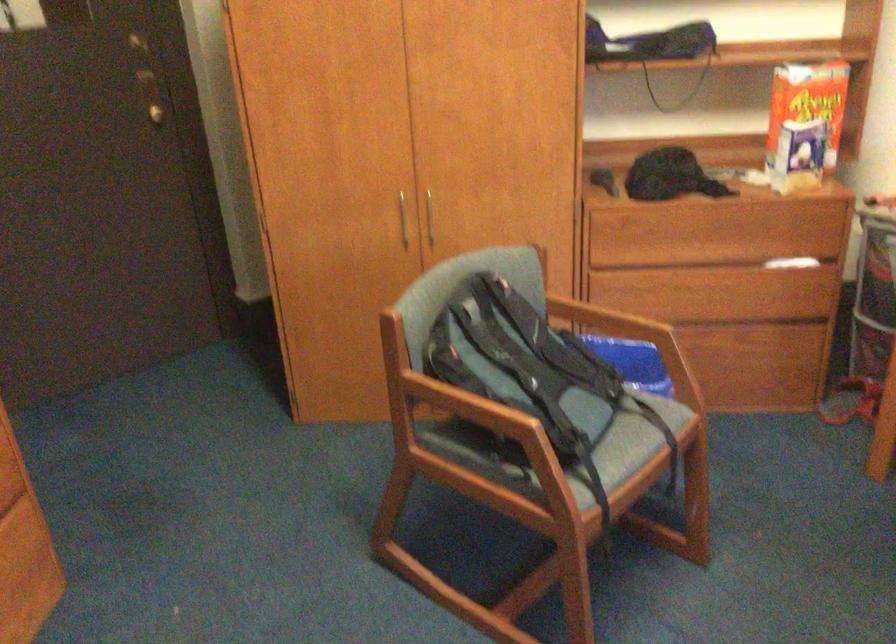
The height and width of the screenshot is (644, 896). I want to click on orange cereal box, so click(807, 102).